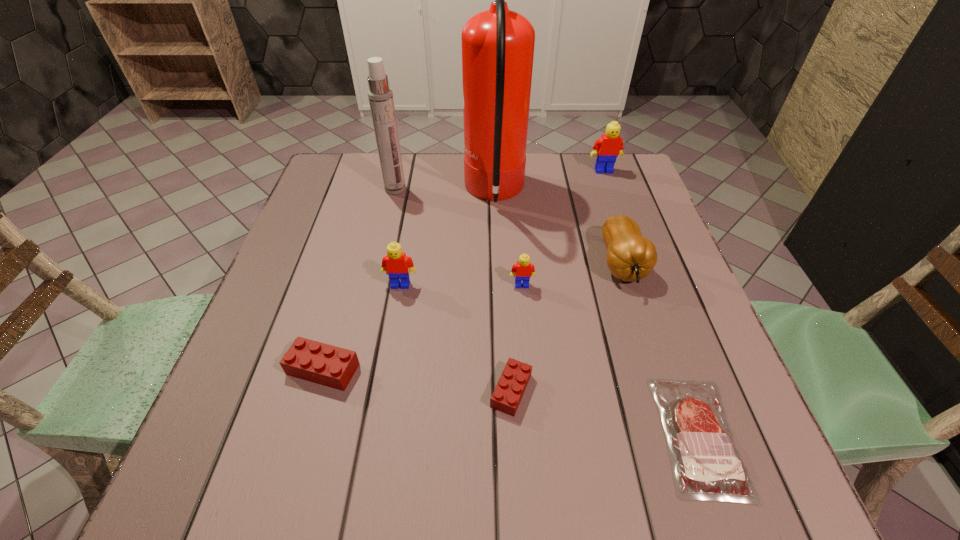
Where is `the third shortest Lego`? This screenshot has height=540, width=960. the third shortest Lego is located at coordinates (522, 270).

In order to click on the third shortest object in this screenshot , I will do `click(324, 364)`.

This screenshot has height=540, width=960. In order to click on the leftmost Lego in this screenshot , I will do `click(324, 364)`.

You are a GUI agent. You are given a task and a screenshot of the screen. Output one action in this format:
    pyautogui.click(x=<x>, y=<y>)
    Task: Click on the shortest Lego
    The height and width of the screenshot is (540, 960).
    Given the screenshot: What is the action you would take?
    pyautogui.click(x=513, y=381)

Identify the location of the right red Lego. The height and width of the screenshot is (540, 960). (513, 381).

The height and width of the screenshot is (540, 960). Identify the location of steak. (705, 461).

Find the location of a particular element. blank space located 0.400m towards the nozzle of the red fire extinguisher is located at coordinates (318, 193).

At what (x,y) coordinates should I click in order to perform the action: click on free space located 0.100m towards the nozzle of the red fire extinguisher. Please return your answer as a coordinate pair (x, y). This screenshot has width=960, height=540. Looking at the image, I should click on (427, 193).

This screenshot has width=960, height=540. Find the location of `vacant region located 0.220m towards the nozzle of the red fire extinguisher`. vacant region located 0.220m towards the nozzle of the red fire extinguisher is located at coordinates (384, 193).

Locate an element on the screen. free point located 0.400m on the front of the aerosol can is located at coordinates (369, 307).